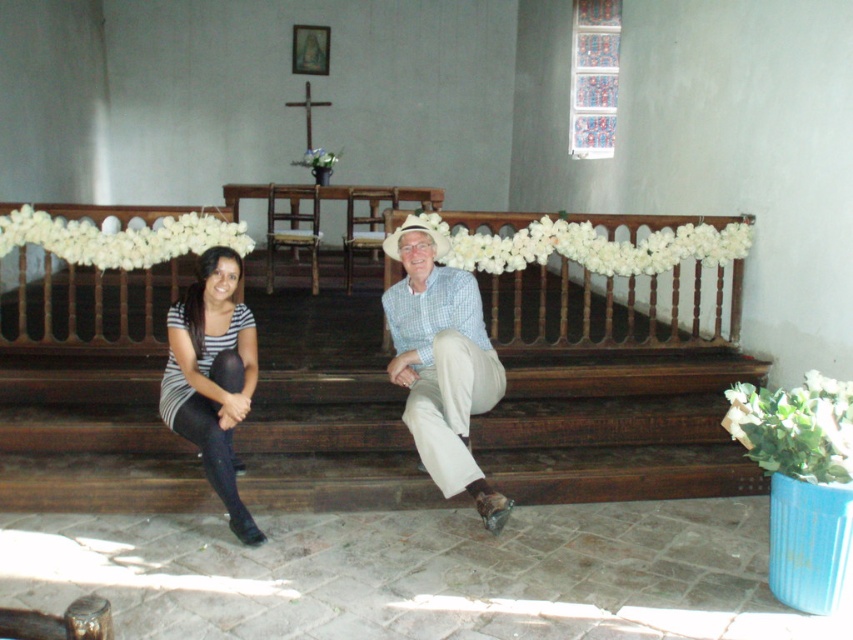
Who is more forward, (486,358) or (254,328)?

Positioned in front is point (486,358).

Can you confirm if striped fabric shirt at center is wider than striped fabric dress at left?

Yes.

Does point (469, 486) come behind point (236, 369)?

Yes, it is.

The image size is (853, 640). What are the coordinates of `striped fabric shirt at center` in the screenshot? It's located at (442, 364).

Can you confirm if green leafy plant at lower right is smaller than white floral garland at center?

Correct, green leafy plant at lower right occupies less space than white floral garland at center.

Between green leafy plant at lower right and white floral garland at center, which one has more height?

green leafy plant at lower right is taller.

Which is behind, point (839, 381) or point (99, 257)?

The point (99, 257) is more distant.

Find the location of `green leafy plant at lower right`. green leafy plant at lower right is located at coordinates (795, 428).

Can you confirm if light blue checkered shirt at center is taller than white fabric garland at center?

Correct, light blue checkered shirt at center is much taller as white fabric garland at center.

Between light blue checkered shirt at center and white fabric garland at center, which one has less height?

white fabric garland at center

Measure the distance between light blue checkered shirt at center and camera.

They are 3.54 meters apart.

I want to click on light blue checkered shirt at center, so click(x=442, y=364).